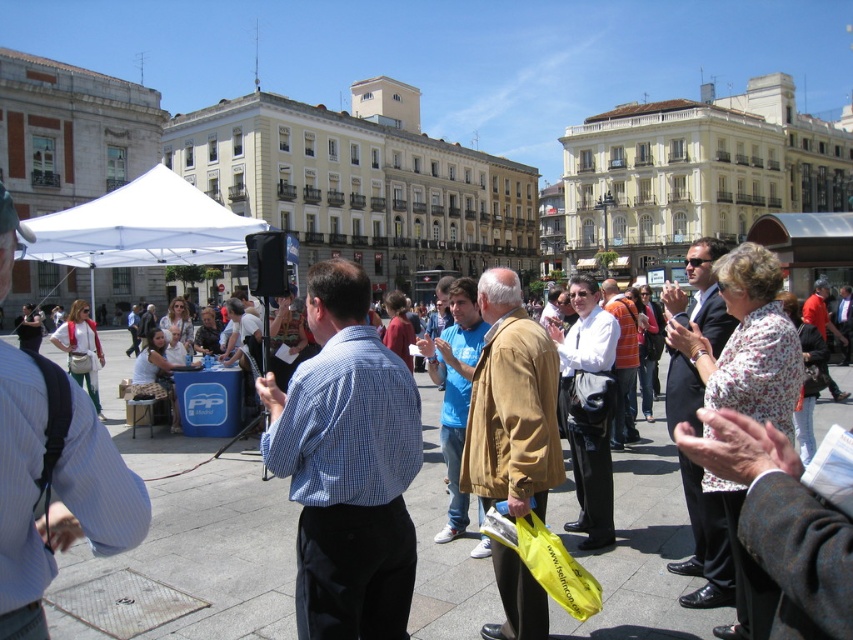
You are standing in the plaza and see the blue checkered shirt at center and the white fabric canopy at upper left. Which object is positioned to the right of the other?

The blue checkered shirt at center is positioned to the right of the white fabric canopy at upper left.